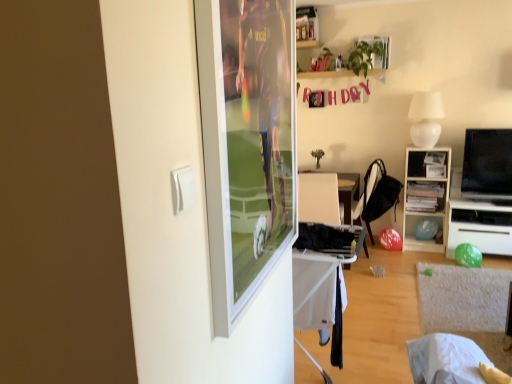
This screenshot has width=512, height=384. Find the location of `free spot in front of wooden bookshelf at right`. free spot in front of wooden bookshelf at right is located at coordinates (428, 258).